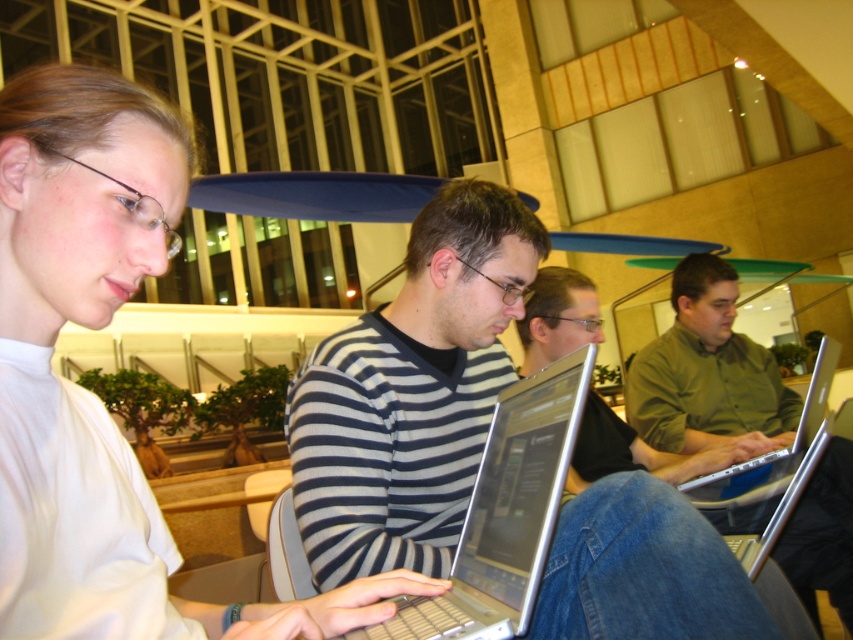
Question: Does striped sweater at center have a lesser width compared to green matte shirt at center?

Choices:
 (A) yes
 (B) no

Answer: (A)

Question: Does matte white shirt at left appear under green matte shirt at center?

Choices:
 (A) no
 (B) yes

Answer: (A)

Question: Observing the image, what is the correct spatial positioning of striped sweater at center in reference to silver metallic laptop at center?

Choices:
 (A) below
 (B) above

Answer: (B)

Question: Which point is farther from the camera taking this photo?

Choices:
 (A) (428, 628)
 (B) (700, 364)
 (C) (474, 435)

Answer: (B)

Question: Which point is closer to the camera taking this photo?

Choices:
 (A) (531, 560)
 (B) (804, 449)
 (C) (380, 326)

Answer: (A)

Question: Estimate the real-world distances between objects in this image. Which object is farther from the matte white shirt at left?

Choices:
 (A) silver metallic laptop at right
 (B) green matte shirt at center

Answer: (B)